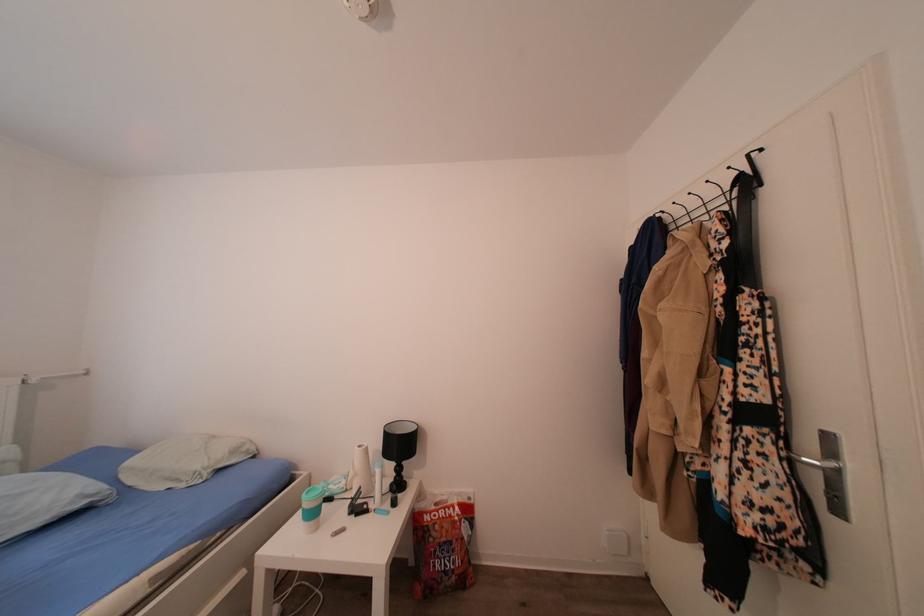
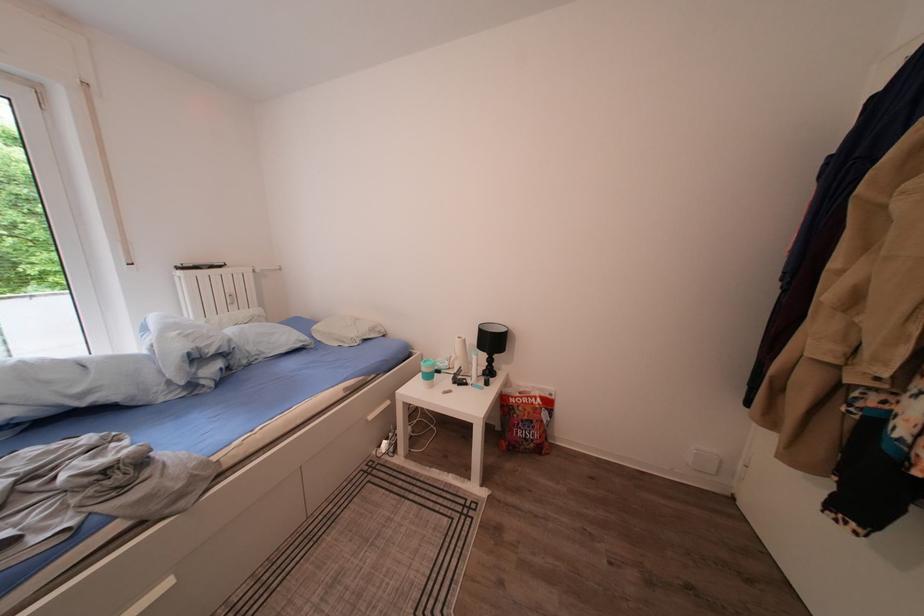
Where in the second image is the point corresponding to point 363,480 from the first image?

(466, 363)